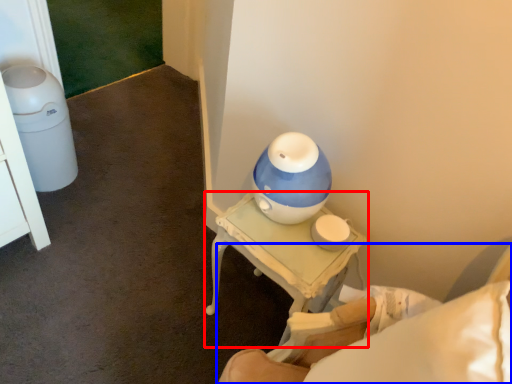
Question: Which object is closer to the camera taking this photo, table (highlighted by a red box) or furniture (highlighted by a blue box)?

Choices:
 (A) table
 (B) furniture

Answer: (B)